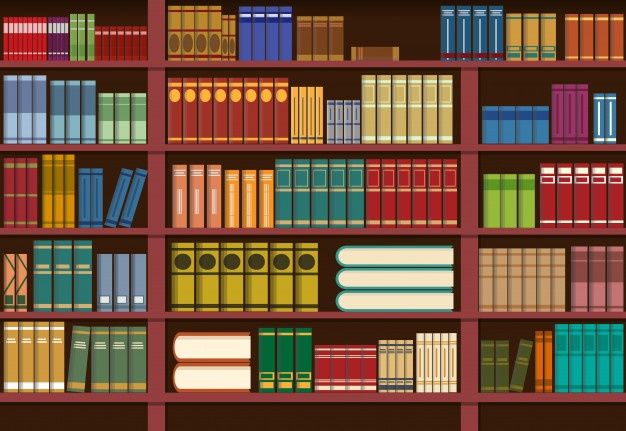
Find the location of a particular element. The image size is (626, 431). computer generated books on left bottom shelf is located at coordinates (9, 358), (24, 362), (38, 363), (54, 363), (74, 365), (96, 366), (113, 367), (136, 366).